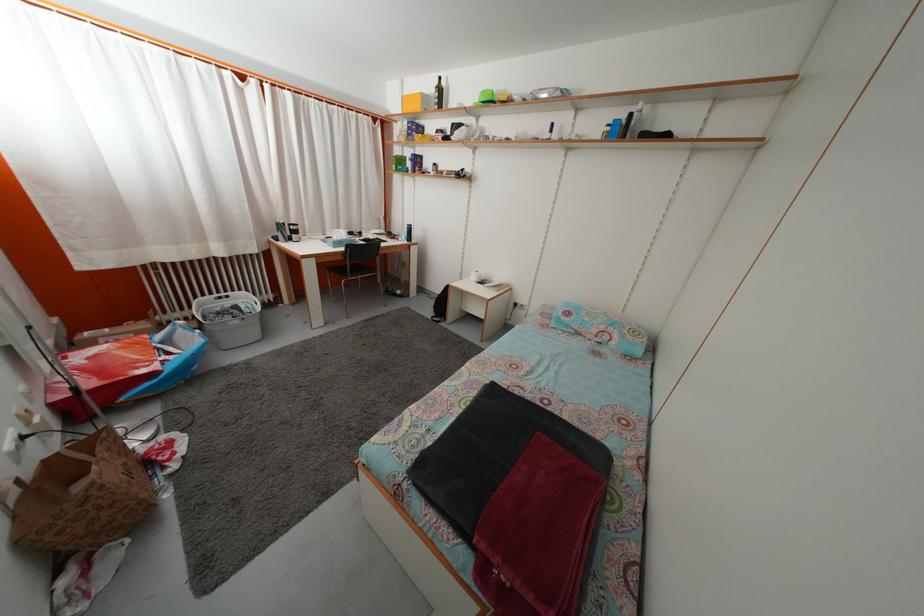
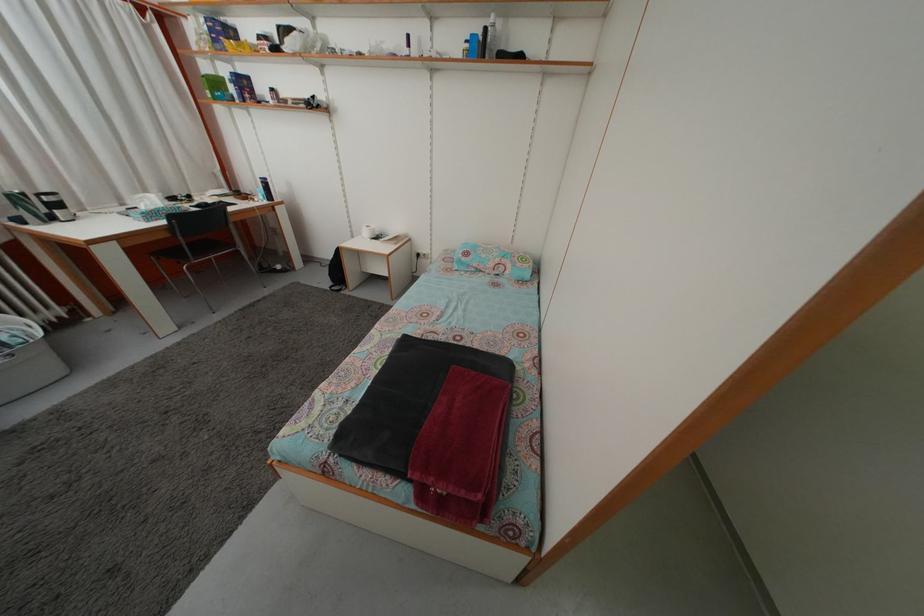
Find the pixel in the second image that matches the point at 330,241 in the first image.

(128, 213)